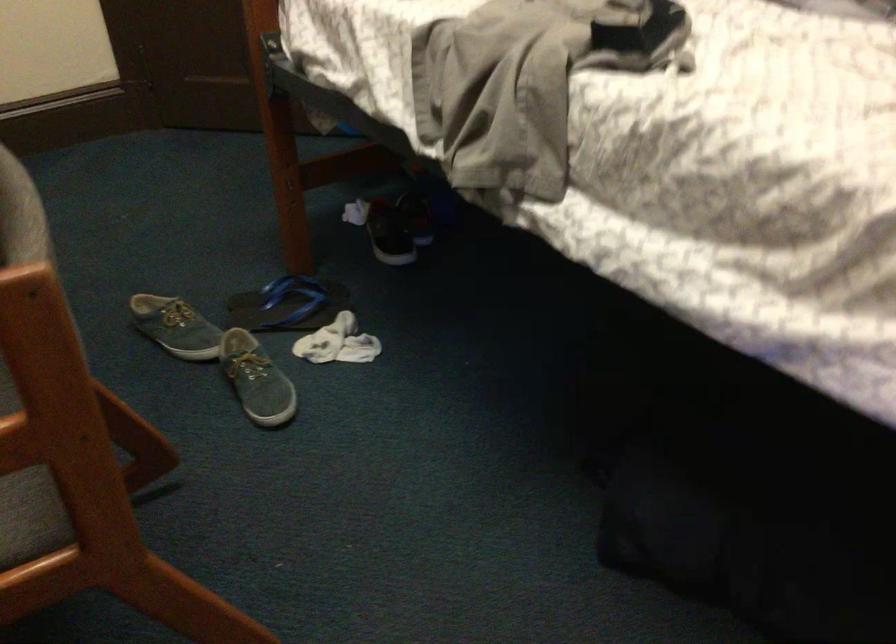
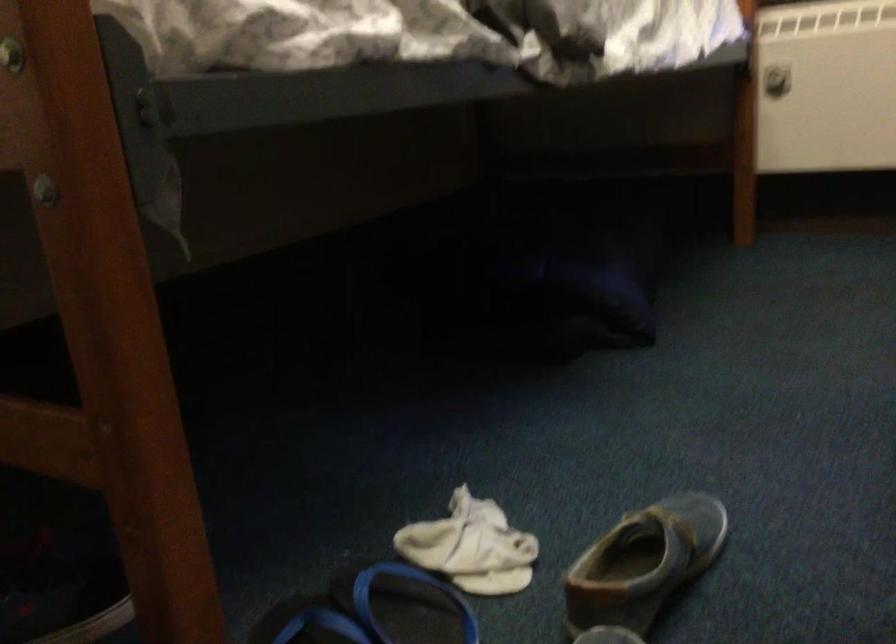
The point at (266,393) is marked in the first image. Where is the corresponding point in the second image?

(643, 563)